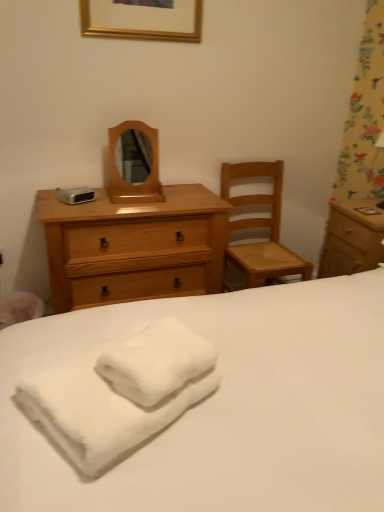
You are a GUI agent. You are given a task and a screenshot of the screen. Output one action in this format:
    pyautogui.click(x=<x>, y=<y>)
    Task: Click on the wooden chair at right
    
    Given the screenshot: What is the action you would take?
    pyautogui.click(x=260, y=227)

What do you see at coordinates (121, 392) in the screenshot?
I see `white fluffy bath towel at lower left` at bounding box center [121, 392].

In order to face gold wooden picture frame at upper center, should I rotate leftwards or rightwards?

Turn left approximately 6.643 degrees to face it.

What do you see at coordinates (226, 406) in the screenshot? I see `white soft towel at center` at bounding box center [226, 406].

At what (x,y) coordinates should I click in order to perform the action: click on wooden chair at right. Please return your answer as a coordinate pair (x, y). Looking at the image, I should click on (260, 227).

Based on the photo, is white fluffy bath towel at lower left beside wooden mirror at center?

No.

Which object is closer to the camera taking this photo, white fluffy bath towel at lower left or wooden mirror at center?

white fluffy bath towel at lower left is more forward.

How many degrees apart are the facing directions of white fluffy bath towel at lower left and wooden mirror at center?

The facing directions of white fluffy bath towel at lower left and wooden mirror at center are 58.3 degrees apart.

Considering the sizes of white fluffy bath towel at lower left and wooden mirror at center in the image, is white fluffy bath towel at lower left taller or shorter than wooden mirror at center?

Answer: In the image, white fluffy bath towel at lower left appears to be shorter than wooden mirror at center.

Locate an element on the screen. The width and height of the screenshot is (384, 512). chest of drawers in front of the wooden chair at right is located at coordinates (134, 247).

Based on the photo, considering the sizes of light brown wooden chest of drawers at center-left and wooden chair at right in the image, is light brown wooden chest of drawers at center-left taller or shorter than wooden chair at right?

Considering their sizes, light brown wooden chest of drawers at center-left has less height than wooden chair at right.

Considering the positions of objects light brown wooden chest of drawers at center-left and wooden chair at right in the image provided, who is more to the left, light brown wooden chest of drawers at center-left or wooden chair at right?

light brown wooden chest of drawers at center-left is more to the left.

From the image's perspective, which object appears higher, light brown wooden chest of drawers at center-left or wooden chair at right?

wooden chair at right is shown above in the image.

Is white soft towel at center aimed at gold wooden picture frame at upper center?

No, white soft towel at center is not facing towards gold wooden picture frame at upper center.

Measure the distance from white soft towel at center to gold wooden picture frame at upper center.

white soft towel at center is 5.07 feet from gold wooden picture frame at upper center.

Is white soft towel at center taller or shorter than gold wooden picture frame at upper center?

Clearly, white soft towel at center is taller compared to gold wooden picture frame at upper center.

Is white soft towel at center to the left or to the right of gold wooden picture frame at upper center in the image?

In the image, white soft towel at center appears on the right side of gold wooden picture frame at upper center.

Identify the location of bath towel that appears above the light brown wooden chest of drawers at center-left (from a real-world perspective). (121, 392).

Does light brown wooden chest of drawers at center-left turn towards white fluffy bath towel at lower left?

Yes, light brown wooden chest of drawers at center-left is oriented towards white fluffy bath towel at lower left.

Visually, is light brown wooden chest of drawers at center-left positioned to the left or to the right of white fluffy bath towel at lower left?

Clearly, light brown wooden chest of drawers at center-left is on the left of white fluffy bath towel at lower left in the image.

Is point (108, 226) closer or farther from the camera than point (86, 362)?

Point (108, 226) is positioned farther from the camera compared to point (86, 362).

Image resolution: width=384 pixels, height=512 pixels. I want to click on bed in front of the white fluffy bath towel at lower left, so click(x=226, y=406).

From the image's perspective, is white fluffy bath towel at lower left under white soft towel at center?

Actually, white fluffy bath towel at lower left appears above white soft towel at center in the image.

What's the angular difference between white fluffy bath towel at lower left and white soft towel at center's facing directions?

The angular difference between white fluffy bath towel at lower left and white soft towel at center is 27.2 degrees.

Between white fluffy bath towel at lower left and gold wooden picture frame at upper center, which one has more height?

With more height is gold wooden picture frame at upper center.

From the image's perspective, relative to gold wooden picture frame at upper center, is white fluffy bath towel at lower left above or below?

From the image's perspective, white fluffy bath towel at lower left appears below gold wooden picture frame at upper center.

Is white fluffy bath towel at lower left in front of or behind gold wooden picture frame at upper center in the image?

In the image, white fluffy bath towel at lower left appears in front of gold wooden picture frame at upper center.

Can you see white fluffy bath towel at lower left touching gold wooden picture frame at upper center?

They are not placed beside each other.

Are white soft towel at center and wooden mirror at center making contact?

No, white soft towel at center is not next to wooden mirror at center.

Which is correct: white soft towel at center is inside wooden mirror at center, or outside of it?

white soft towel at center is not enclosed by wooden mirror at center.

Considering the sizes of objects white soft towel at center and wooden mirror at center in the image provided, who is shorter, white soft towel at center or wooden mirror at center?

wooden mirror at center is shorter.

The height and width of the screenshot is (512, 384). What are the coordinates of `bath towel in front of the wooden mirror at center` in the screenshot? It's located at (121, 392).

You are a GUI agent. You are given a task and a screenshot of the screen. Output one action in this format:
    pyautogui.click(x=<x>, y=<y>)
    Task: Click on the chair above the light brown wooden chest of drawers at center-left (from the image's perspective)
    This screenshot has height=512, width=384.
    Given the screenshot: What is the action you would take?
    pyautogui.click(x=260, y=227)

When comparing their distances from light brown wooden chest of drawers at center-left, does white soft towel at center or wooden chair at right seem closer?

Among the two, wooden chair at right is located nearer to light brown wooden chest of drawers at center-left.

Estimate the real-world distances between objects in this image. Which object is closer to wooden mirror at center, white fluffy bath towel at lower left or light brown wooden chest of drawers at center-left?

light brown wooden chest of drawers at center-left.

Which object lies further to the anchor point wooden nightstand at right, light brown wooden chest of drawers at center-left or gold wooden picture frame at upper center?

Among the two, gold wooden picture frame at upper center is located further to wooden nightstand at right.

When comparing their distances from wooden mirror at center, does wooden nightstand at right or wooden chair at right seem closer?

wooden chair at right is positioned closer to the anchor wooden mirror at center.

Based on their spatial positions, is wooden chair at right or white fluffy bath towel at lower left closer to white soft towel at center?

Based on the image, white fluffy bath towel at lower left appears to be nearer to white soft towel at center.

Looking at the image, which one is located further to white fluffy bath towel at lower left, gold wooden picture frame at upper center or wooden mirror at center?

gold wooden picture frame at upper center is positioned further to the anchor white fluffy bath towel at lower left.

When comparing their distances from gold wooden picture frame at upper center, does wooden nightstand at right or wooden mirror at center seem closer?

Based on the image, wooden mirror at center appears to be nearer to gold wooden picture frame at upper center.

Looking at the image, which one is located closer to white soft towel at center, wooden chair at right or light brown wooden chest of drawers at center-left?

light brown wooden chest of drawers at center-left.

The image size is (384, 512). In order to click on mirror between light brown wooden chest of drawers at center-left and wooden chair at right from left to right in this screenshot , I will do (121, 177).

In order to click on mirror between white soft towel at center and wooden chair at right from front to back in this screenshot , I will do `click(121, 177)`.

Identify the location of the chest of drawers located between white soft towel at center and wooden nightstand at right in the depth direction. (134, 247).

Find the location of a particular element. The image size is (384, 512). mirror between gold wooden picture frame at upper center and white fluffy bath towel at lower left from top to bottom is located at coordinates (121, 177).